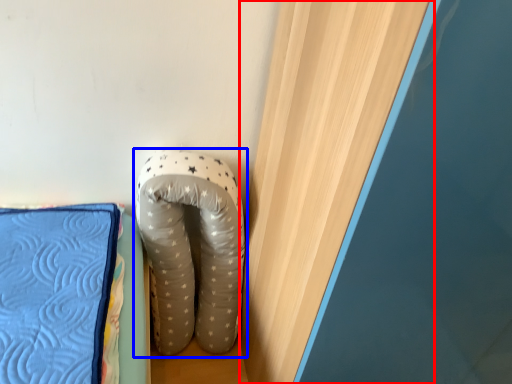
Question: Which of the following is the farthest to the observer, curtain (highlighted by a red box) or footwear (highlighted by a blue box)?

Choices:
 (A) curtain
 (B) footwear

Answer: (B)